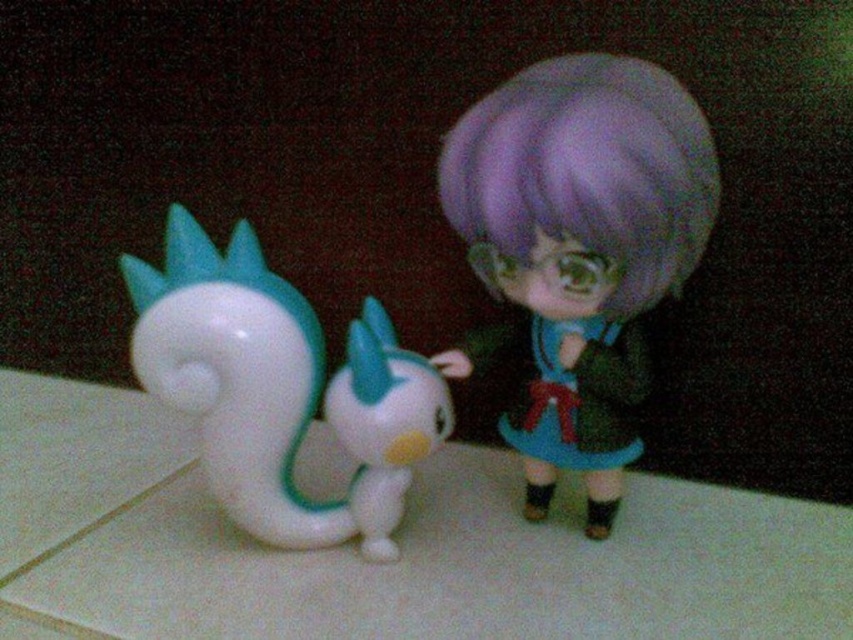
You are placing a sticker on the white glossy toy at left. What coordinates should you aim for?

You should aim for coordinates point (x=279, y=388).

You are setting up a display and need to place two items exactly 7 centimeters apart. You have a white glossy toy at left and a white glossy bird at center. Can you place them correctly?

The white glossy toy at left is currently 6.22 centimeters from the white glossy bird at center, which is less than 7 centimeters. To meet the requirement, you need to move them slightly farther apart.

You are organizing a display and want to place a small decorative item between the purple matte doll at center and the white glossy bird at center. Which figurine should you place the item closer to if you want it to be equidistant from both?

The purple matte doll at center is larger in size than the white glossy bird at center, so you should place the item closer to the smaller white glossy bird at center to achieve equal distance from both.